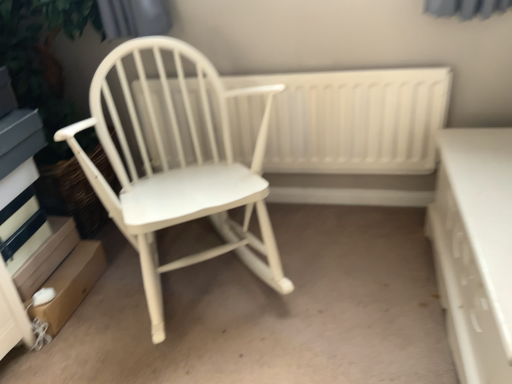
Question: Is white wood rocking chair at left oriented towards white wood radiator at center?

Choices:
 (A) no
 (B) yes

Answer: (A)

Question: From the image's perspective, is white wood rocking chair at left on white wood radiator at center?

Choices:
 (A) no
 (B) yes

Answer: (A)

Question: Does white wood rocking chair at left have a lesser width compared to white wood radiator at center?

Choices:
 (A) yes
 (B) no

Answer: (B)

Question: Is white wood rocking chair at left at the left side of white wood radiator at center?

Choices:
 (A) no
 (B) yes

Answer: (B)

Question: Considering the relative sizes of white wood rocking chair at left and white wood radiator at center in the image provided, is white wood rocking chair at left taller than white wood radiator at center?

Choices:
 (A) no
 (B) yes

Answer: (B)

Question: In the image, is white glossy drawer at right positioned in front of or behind white wood rocking chair at left?

Choices:
 (A) behind
 (B) front

Answer: (B)

Question: From a real-world perspective, is white glossy drawer at right physically located above or below white wood rocking chair at left?

Choices:
 (A) below
 (B) above

Answer: (A)

Question: Is white glossy drawer at right inside or outside of white wood rocking chair at left?

Choices:
 (A) outside
 (B) inside

Answer: (A)

Question: Based on their positions, is white glossy drawer at right located to the left or right of white wood rocking chair at left?

Choices:
 (A) left
 (B) right

Answer: (B)

Question: Based on their positions, is white wood rocking chair at left located to the left or right of white wood radiator at center?

Choices:
 (A) left
 (B) right

Answer: (A)

Question: In terms of size, does white wood rocking chair at left appear bigger or smaller than white wood radiator at center?

Choices:
 (A) big
 (B) small

Answer: (A)

Question: Is white wood rocking chair at left spatially inside white wood radiator at center, or outside of it?

Choices:
 (A) outside
 (B) inside

Answer: (A)

Question: Considering the positions of white wood rocking chair at left and white wood radiator at center in the image, is white wood rocking chair at left wider or thinner than white wood radiator at center?

Choices:
 (A) thin
 (B) wide

Answer: (B)

Question: In terms of height, does white wood rocking chair at left look taller or shorter compared to white glossy drawer at right?

Choices:
 (A) tall
 (B) short

Answer: (A)

Question: From the image's perspective, relative to white glossy drawer at right, is white wood rocking chair at left above or below?

Choices:
 (A) above
 (B) below

Answer: (A)